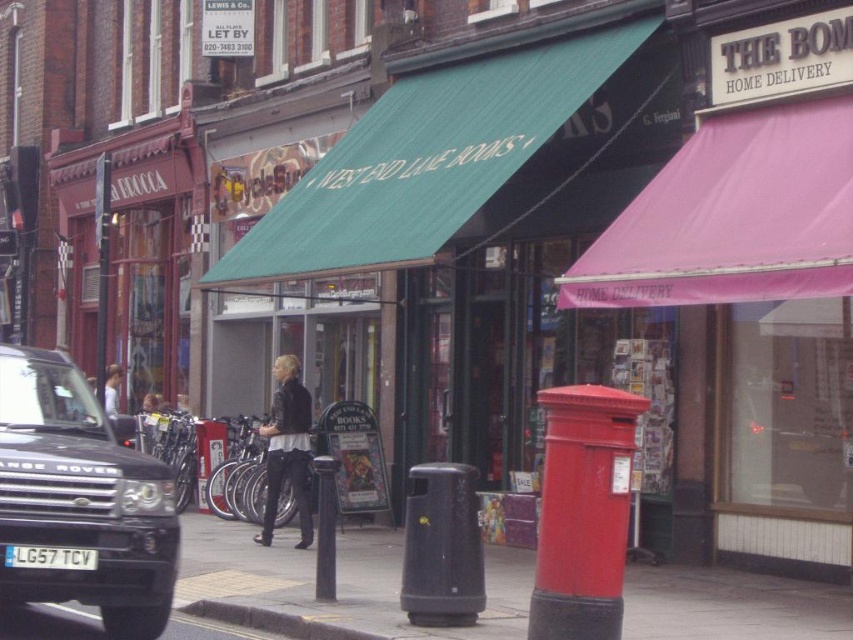
Measure the distance from black asphalt pavement at lower center to white plastic license plate at lower left.

4.20 meters

Identify the location of black asphalt pavement at lower center. The image size is (853, 640). (338, 580).

Between black metallic car at left and yellow painted concrete curb at lower center, which one appears on the right side from the viewer's perspective?

yellow painted concrete curb at lower center is more to the right.

Can you confirm if black metallic car at left is shorter than yellow painted concrete curb at lower center?

Incorrect, black metallic car at left's height does not fall short of yellow painted concrete curb at lower center's.

This screenshot has height=640, width=853. What do you see at coordinates (80, 499) in the screenshot? I see `black metallic car at left` at bounding box center [80, 499].

Where is `black metallic car at left`? black metallic car at left is located at coordinates pyautogui.click(x=80, y=499).

Between black metallic car at left and black asphalt pavement at lower center, which one appears on the right side from the viewer's perspective?

Positioned to the right is black asphalt pavement at lower center.

Which of these two, black metallic car at left or black asphalt pavement at lower center, stands taller?

Standing taller between the two is black metallic car at left.

Measure the distance between point (x=146, y=486) and camera.

8.24 meters

Locate an element on the screen. The width and height of the screenshot is (853, 640). black metallic car at left is located at coordinates (80, 499).